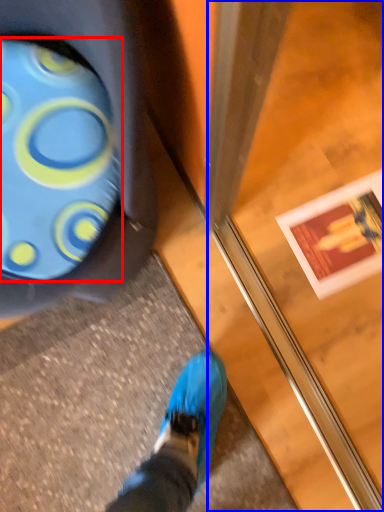
Question: Which object is closer to the camera taking this photo, footwear (highlighted by a red box) or screen door (highlighted by a blue box)?

Choices:
 (A) footwear
 (B) screen door

Answer: (B)